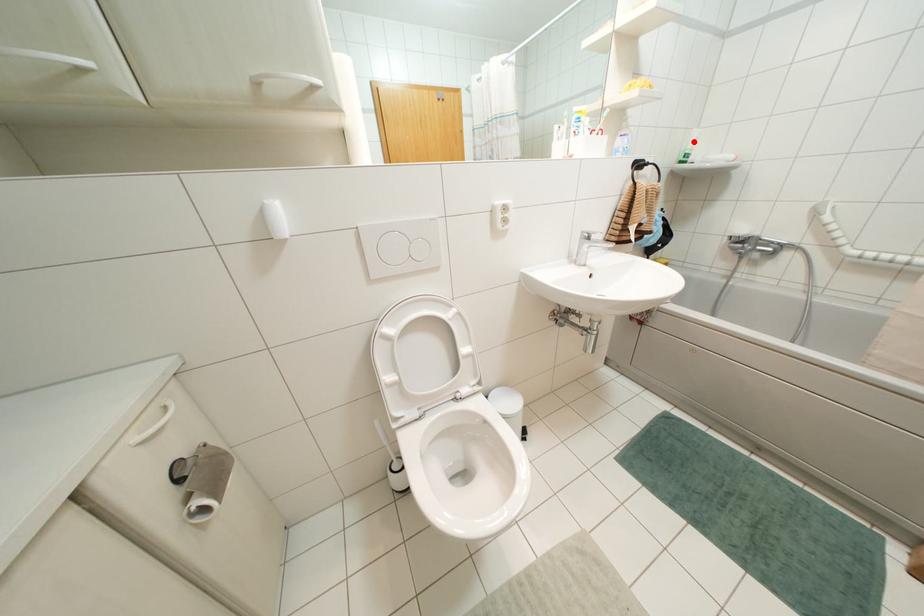
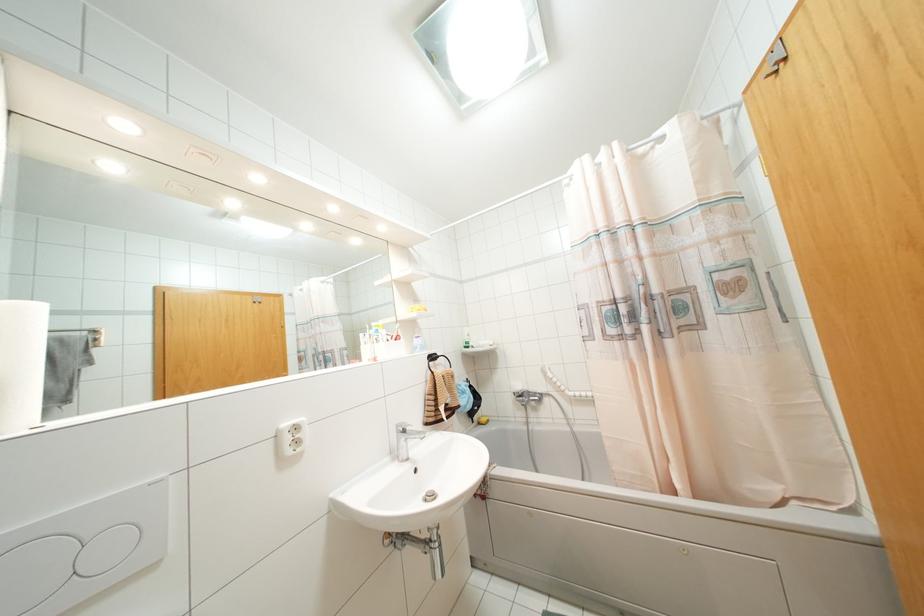
In the second image, find the point that corresponds to the highlighted location in the first image.

(468, 334)